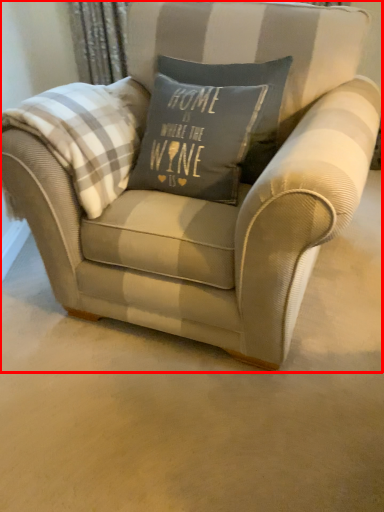
Question: Observing the image, what is the correct spatial positioning of chair (annotated by the red box) in reference to plaid?

Choices:
 (A) left
 (B) right

Answer: (B)